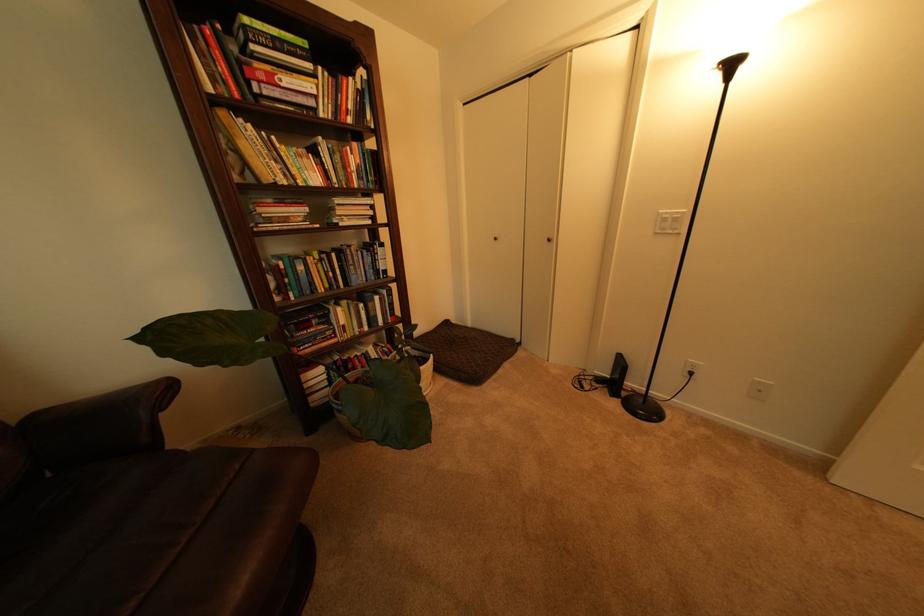
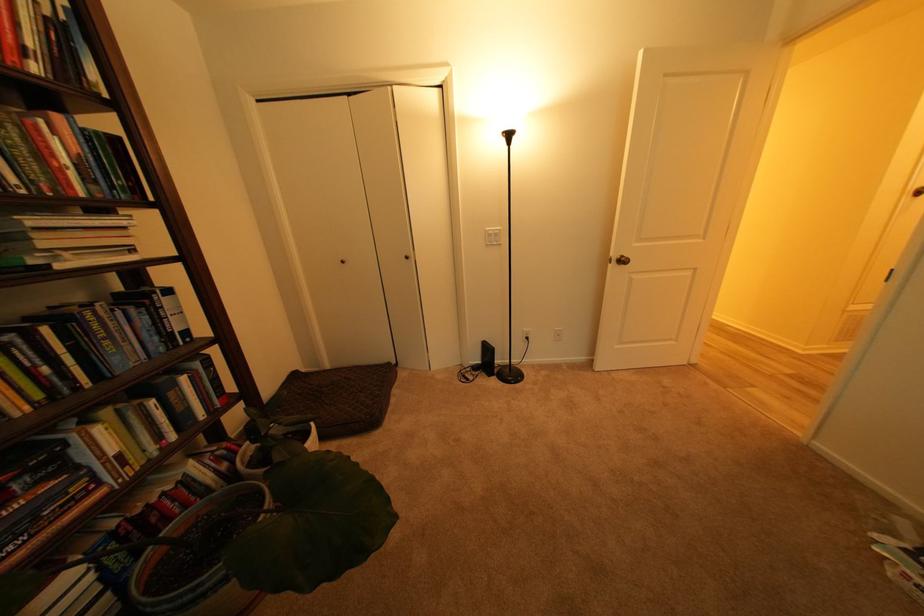
Where in the second image is the point corresponding to pixel 618 378 from the first image?

(490, 363)